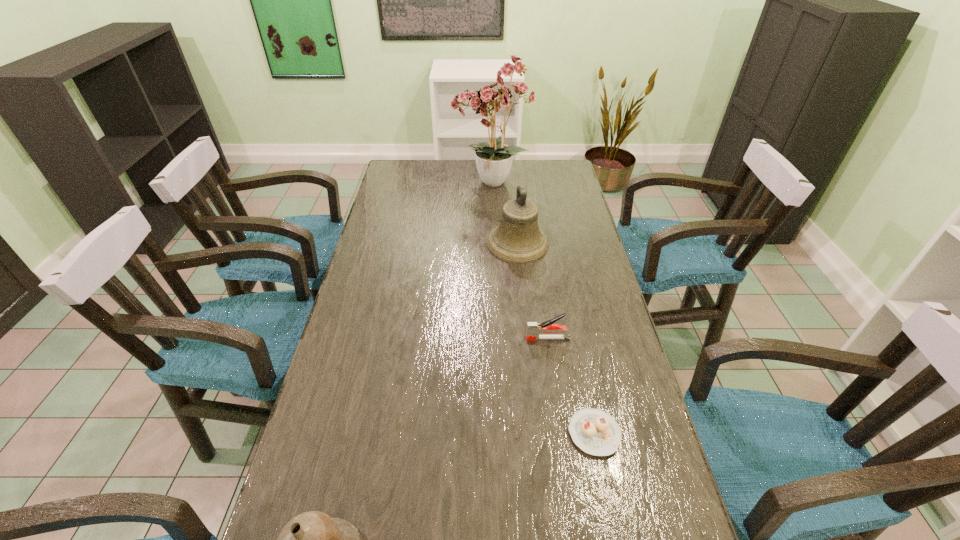
The height and width of the screenshot is (540, 960). Find the location of `vacant space that satisfies the following two spatial constraints: 1. on the front-facing side of the farthest object; 2. on the back side of the farther bell`. vacant space that satisfies the following two spatial constraints: 1. on the front-facing side of the farthest object; 2. on the back side of the farther bell is located at coordinates (492, 244).

You are a GUI agent. You are given a task and a screenshot of the screen. Output one action in this format:
    pyautogui.click(x=<x>, y=<y>)
    Task: Click on the free space that satisfies the following two spatial constraints: 1. on the handle side of the cupcake; 2. on the right side of the fourth tallest object
    The image size is (960, 540).
    Given the screenshot: What is the action you would take?
    pyautogui.click(x=562, y=434)

Identify the location of blank space that satisfies the following two spatial constraints: 1. on the handle side of the stapler; 2. on the back side of the fourth farthest object. (562, 434).

The height and width of the screenshot is (540, 960). What are the coordinates of `free point that satisfies the following two spatial constraints: 1. on the front-facing side of the shortest object; 2. on the right side of the tallest object` in the screenshot? It's located at (499, 434).

Identify the location of vacant space that satisfies the following two spatial constraints: 1. on the back side of the fourth shortest object; 2. on the front-facing side of the tallest object. (511, 184).

Locate an element on the screen. free point that satisfies the following two spatial constraints: 1. on the front side of the farther bell; 2. on the right side of the cupcake is located at coordinates (537, 434).